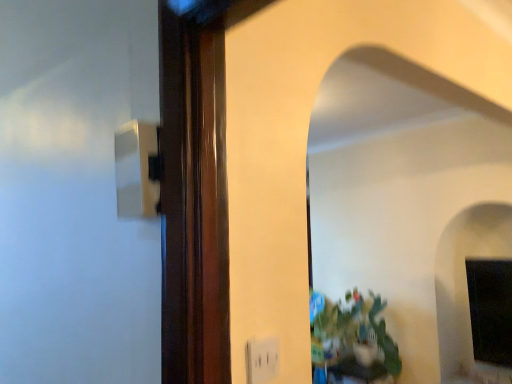
Image resolution: width=512 pixels, height=384 pixels. Describe the element at coordinates (137, 170) in the screenshot. I see `white glossy light switch at upper left` at that location.

Find the location of a particular element. white glossy light switch at upper left is located at coordinates (137, 170).

Locate an element on the screen. This screenshot has width=512, height=384. white glossy light switch at upper left is located at coordinates (137, 170).